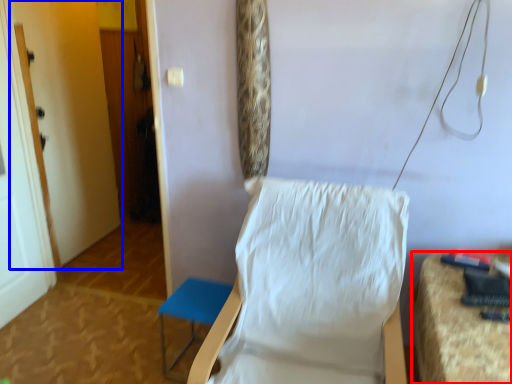
Question: Among these objects, which one is farthest to the camera, furniture (highlighted by a red box) or door (highlighted by a blue box)?

Choices:
 (A) furniture
 (B) door

Answer: (B)